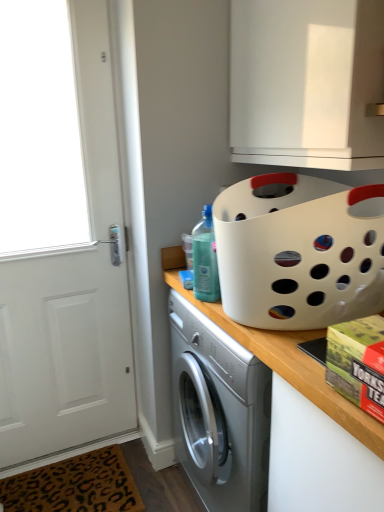
Locate an element on the screen. The width and height of the screenshot is (384, 512). empty space that is ontop of brown leopard print mat at lower left (from a real-world perspective) is located at coordinates (77, 492).